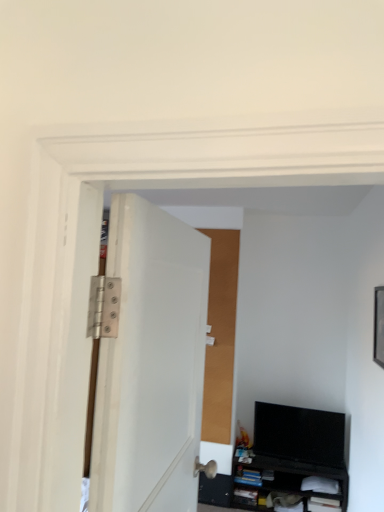
Question: From a real-world perspective, is black glossy tv at lower right positioned above or below black matte cabinet at lower right?

Choices:
 (A) below
 (B) above

Answer: (B)

Question: Considering the positions of black glossy tv at lower right and black matte cabinet at lower right in the image, is black glossy tv at lower right taller or shorter than black matte cabinet at lower right?

Choices:
 (A) tall
 (B) short

Answer: (A)

Question: Which object is positioned closest to the white matte door at center?

Choices:
 (A) black glossy tv at lower right
 (B) black matte cabinet at lower right

Answer: (A)

Question: Estimate the real-world distances between objects in this image. Which object is farther from the white matte door at center?

Choices:
 (A) black matte cabinet at lower right
 (B) black glossy tv at lower right

Answer: (A)